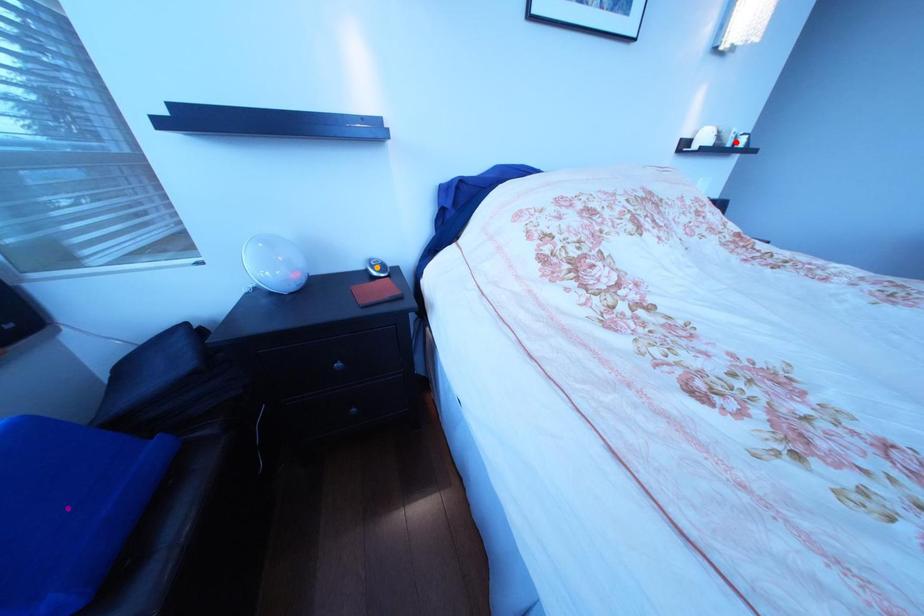
Order these from nearest to farthest:
purple point
orange point
red point

red point < orange point < purple point